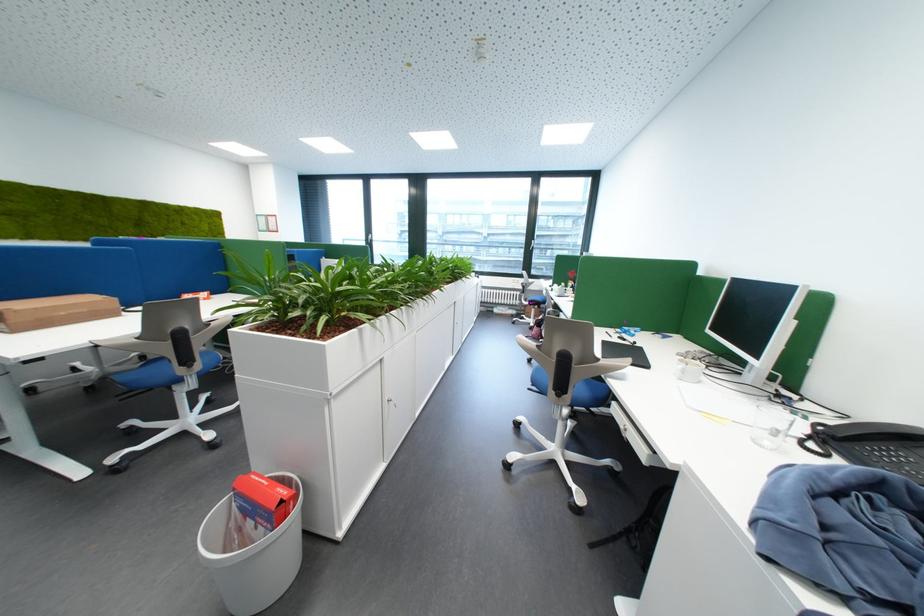
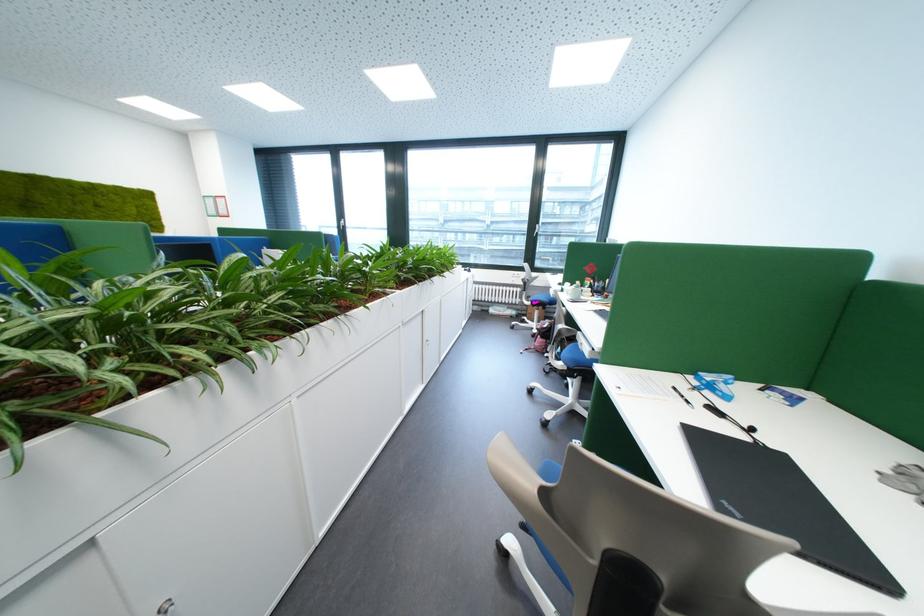
Question: Based on the continuous images, in which direction is the camera rotating? Reply with the corresponding letter.

Choices:
 (A) Left
 (B) Right
 (C) Up
 (D) Down

Answer: (D)